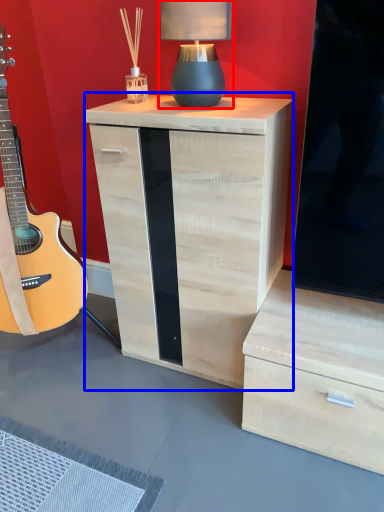
Question: Which object is further to the camera taking this photo, table lamp (highlighted by a red box) or nightstand (highlighted by a blue box)?

Choices:
 (A) table lamp
 (B) nightstand

Answer: (A)